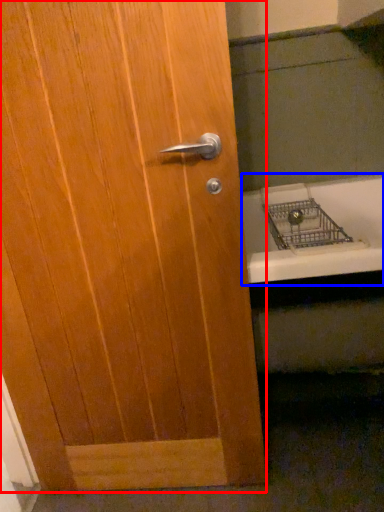
Question: Which point is closer to the camera, door (highlighted by a red box) or bath (highlighted by a blue box)?

Choices:
 (A) door
 (B) bath

Answer: (A)